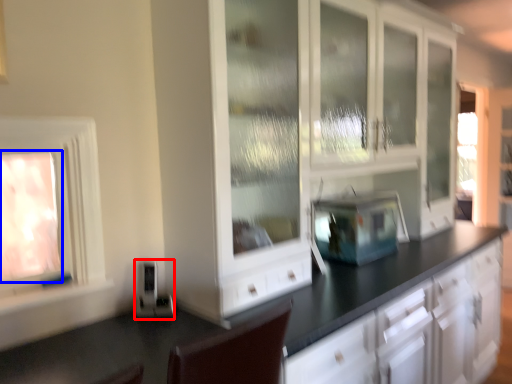
Question: Among these objects, which one is nearest to the camera, appliance (highlighted by a red box) or window (highlighted by a blue box)?

Choices:
 (A) appliance
 (B) window

Answer: (B)